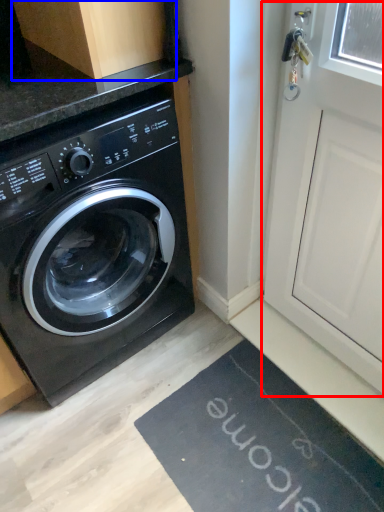
Question: Which point is closer to the camera, screen door (highlighted by a red box) or cabinetry (highlighted by a blue box)?

Choices:
 (A) screen door
 (B) cabinetry

Answer: (A)